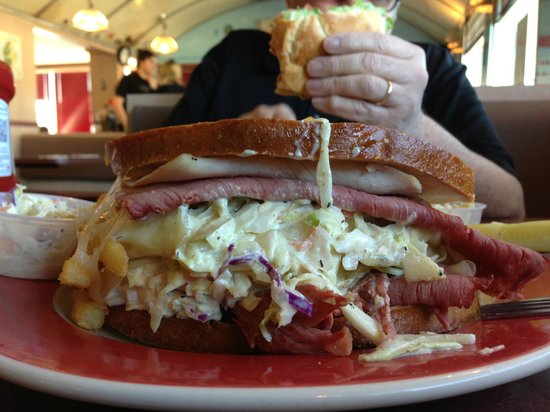
Locate an element on the screen. This screenshot has height=412, width=550. sandwich on somebody's plate is located at coordinates (273, 206).